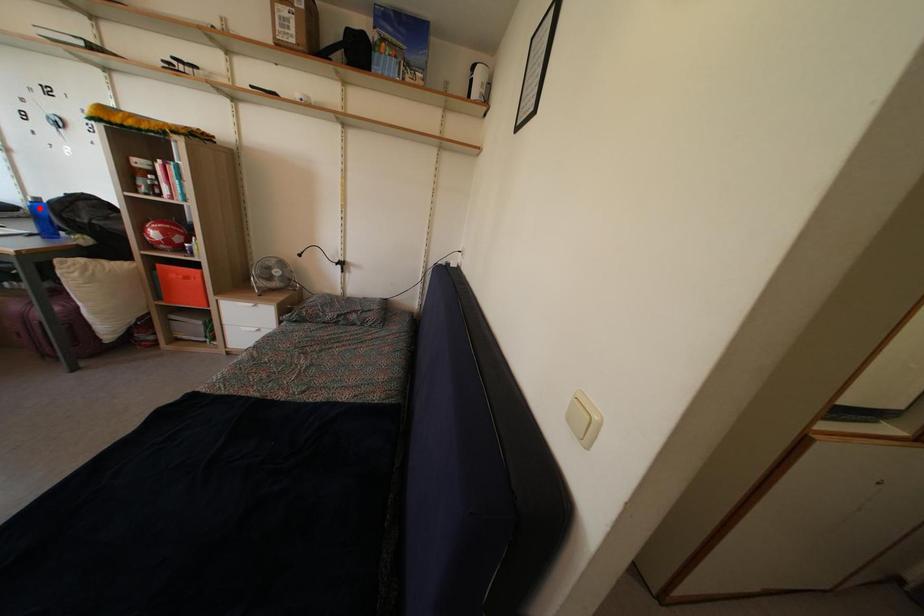
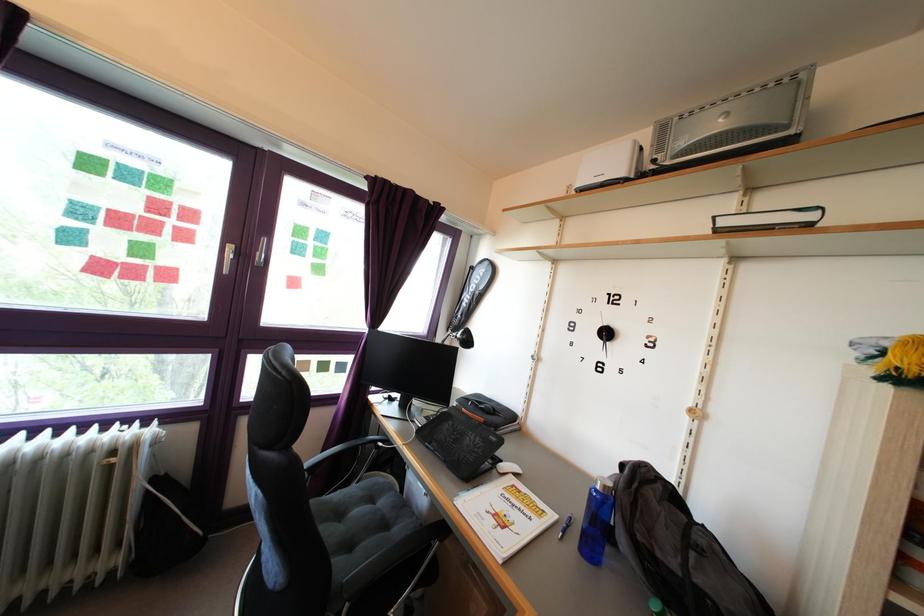
The point at the highlighted location is marked in the first image. Where is the corresponding point in the second image?

(609, 496)